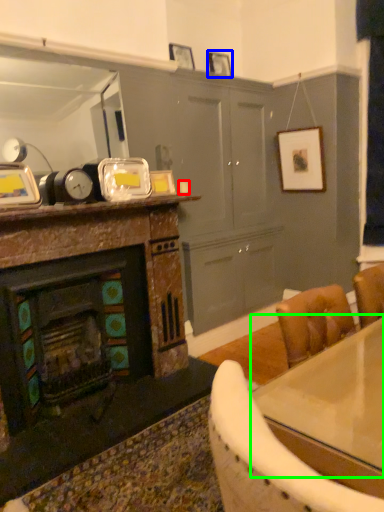
Question: Which object is the closest to the coffee cup (highlighted by a red box)? Choose among these: picture frame (highlighted by a blue box) or counter top (highlighted by a green box).

Choices:
 (A) picture frame
 (B) counter top

Answer: (A)